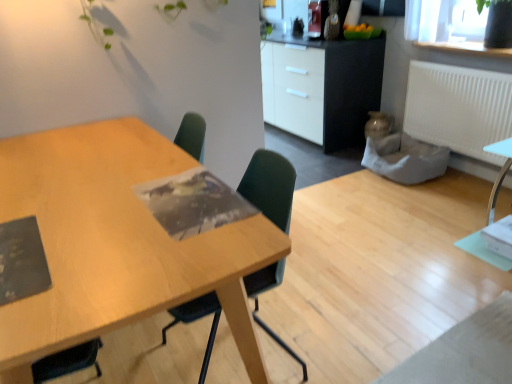
Question: Is white matte radiator at upper right completely or partially inside green plastic chair at center?

Choices:
 (A) yes
 (B) no

Answer: (B)

Question: Considering the relative positions of green plastic chair at center and white matte radiator at upper right in the image provided, is green plastic chair at center behind white matte radiator at upper right?

Choices:
 (A) no
 (B) yes

Answer: (A)

Question: Considering the relative sizes of green plastic chair at center and white matte radiator at upper right in the image provided, is green plastic chair at center thinner than white matte radiator at upper right?

Choices:
 (A) yes
 (B) no

Answer: (B)

Question: Can you see green plastic chair at center touching white matte radiator at upper right?

Choices:
 (A) no
 (B) yes

Answer: (A)

Question: Is green plastic chair at center positioned beyond the bounds of white matte radiator at upper right?

Choices:
 (A) no
 (B) yes

Answer: (B)

Question: Considering their positions, is green plastic chair at center located in front of or behind transparent glass vase at upper right?

Choices:
 (A) front
 (B) behind

Answer: (A)

Question: Considering the positions of point (199, 307) and point (414, 11), is point (199, 307) closer or farther from the camera than point (414, 11)?

Choices:
 (A) farther
 (B) closer

Answer: (B)

Question: From their relative heights in the image, would you say green plastic chair at center is taller or shorter than transparent glass vase at upper right?

Choices:
 (A) short
 (B) tall

Answer: (B)

Question: From a real-world perspective, relative to transparent glass vase at upper right, is green plastic chair at center vertically above or below?

Choices:
 (A) above
 (B) below

Answer: (B)

Question: Relative to white glossy cabinet at upper center, is wooden table at center in front or behind?

Choices:
 (A) behind
 (B) front

Answer: (B)

Question: Based on their sizes in the image, would you say wooden table at center is bigger or smaller than white glossy cabinet at upper center?

Choices:
 (A) small
 (B) big

Answer: (A)

Question: From a real-world perspective, relative to white glossy cabinet at upper center, is wooden table at center vertically above or below?

Choices:
 (A) above
 (B) below

Answer: (B)

Question: Considering the positions of wooden table at center and white glossy cabinet at upper center in the image, is wooden table at center wider or thinner than white glossy cabinet at upper center?

Choices:
 (A) wide
 (B) thin

Answer: (A)

Question: Based on their sizes in the image, would you say white matte radiator at upper right is bigger or smaller than green plastic chair at center?

Choices:
 (A) big
 (B) small

Answer: (B)

Question: In terms of height, does white matte radiator at upper right look taller or shorter compared to green plastic chair at center?

Choices:
 (A) short
 (B) tall

Answer: (A)